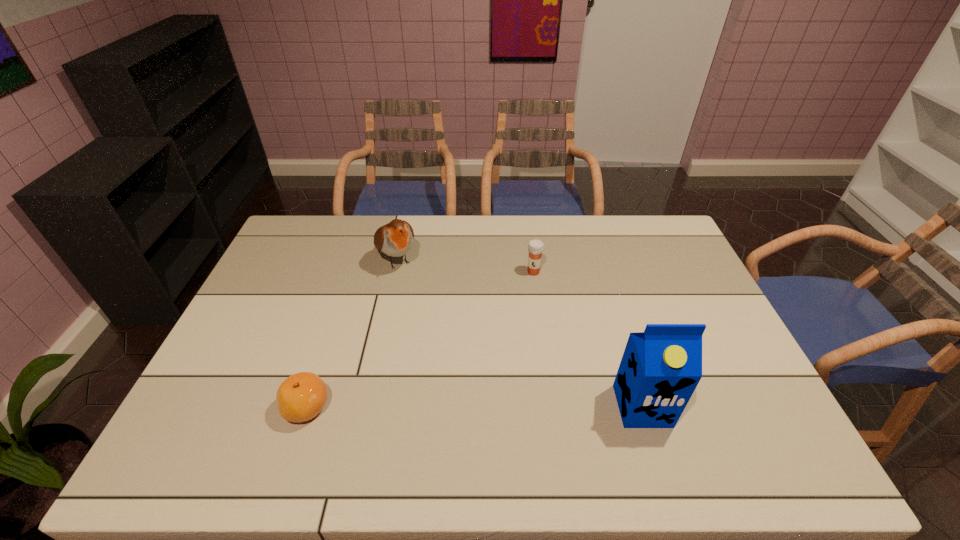
This screenshot has width=960, height=540. What are the coordinates of `free point between the second shortest object and the tallest object` in the screenshot? It's located at (588, 339).

What are the coordinates of `empty location between the bird and the tallest object` in the screenshot? It's located at (519, 333).

At what (x,y) coordinates should I click in order to perform the action: click on empty space that is in between the third object from left to right and the second object from left to right. Please return your answer as a coordinate pair (x, y). Image resolution: width=960 pixels, height=540 pixels. Looking at the image, I should click on pyautogui.click(x=465, y=265).

I want to click on object that stands as the closest to the third object from left to right, so click(395, 239).

Identify the location of object that stands as the second closest to the leftmost object. The height and width of the screenshot is (540, 960). (536, 247).

This screenshot has width=960, height=540. I want to click on free location that satisfies the following two spatial constraints: 1. on the back side of the bird; 2. on the left side of the shortest object, so click(x=355, y=259).